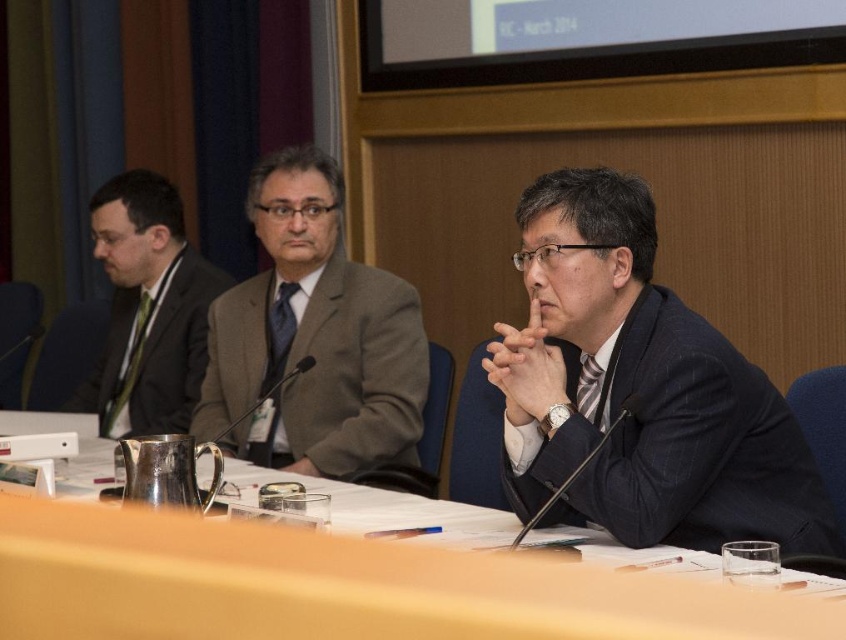
In the formal meeting scene, there are three people seated at a long table. The middle individual is wearing a light brown suit, and the person on the far left is wearing a dark blue textured suit represented by point [678,445]. Which person is wearing the dark blue textured suit?

The person on the far left is wearing the dark blue textured suit represented by point [678,445].

You are a photographer positioned behind the long table in the conference room. You want to take a photo of the gray woolen suit at center and the green silk business suit at left. Which one will appear larger in your photo?

The gray woolen suit at center appears larger in the photo because it is closer to the viewer than the green silk business suit at left.

You are standing at the entrance of the conference room and want to approach the smooth wooden table at center. Which direction should you walk to reach it?

Since the smooth wooden table at center is located at point coordinates of [352,576], you should walk forward towards the center of the room to reach it.